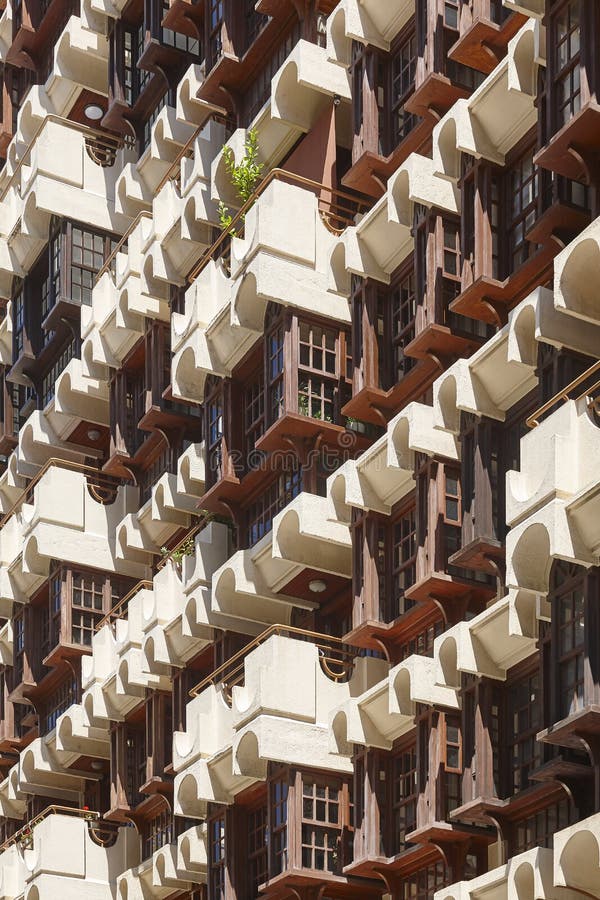
Find the location of a particular element. The width and height of the screenshot is (600, 900). green hanging plants is located at coordinates (251, 176), (185, 552), (223, 217).